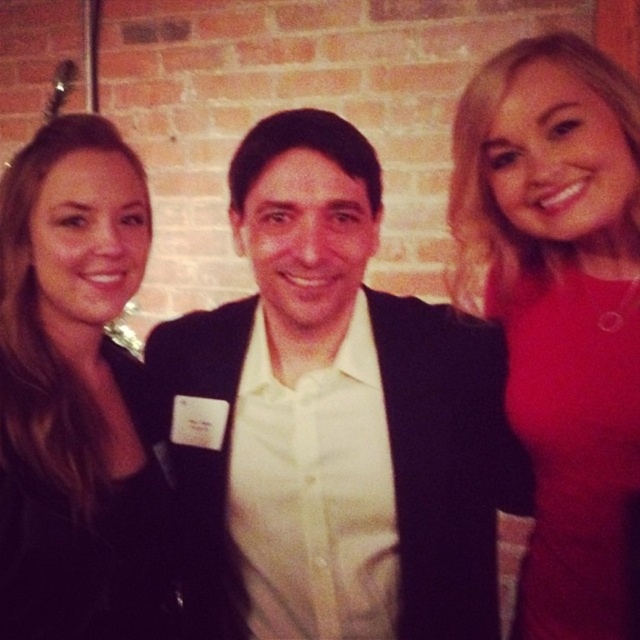
You are standing in front of the group photo and want to take a closer look at the point marked at coordinates point (506, 348). If your hand can reach up to 1 meter, can you touch that point without moving your feet?

The distance of point (506, 348) from the camera is 1.09 meters, so your hand cannot reach it since it is slightly farther than 1 meter.

You are a photographer trying to adjust the lighting for a group photo. You notice the black leather jacket at left and the matte red dress at right. Which clothing item requires more space in the frame to avoid being cut off?

The black leather jacket at left requires more space in the frame because it is larger in size than the matte red dress at right.